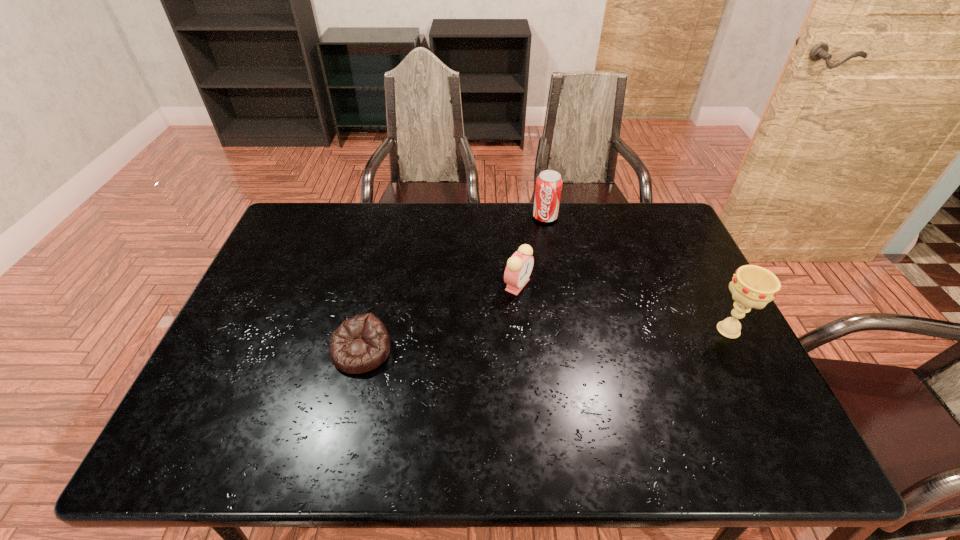
You are a GUI agent. You are given a task and a screenshot of the screen. Output one action in this format:
    pyautogui.click(x=<x>, y=<y>)
    Task: Click on the free spot at the far left corner of the desktop
    Image resolution: width=960 pixels, height=540 pixels.
    Given the screenshot: What is the action you would take?
    pyautogui.click(x=326, y=214)

The width and height of the screenshot is (960, 540). In the image, there is a desktop. What are the coordinates of `vacant space at the far right corner` in the screenshot? It's located at (634, 240).

Identify the location of unoccupied area between the beanbag and the third object from right to left. Image resolution: width=960 pixels, height=540 pixels. (440, 318).

This screenshot has height=540, width=960. I want to click on free space between the third tallest object and the shortest object, so click(440, 318).

Find the location of a particular element. Image resolution: width=960 pixels, height=540 pixels. unoccupied position between the shortest object and the rightmost object is located at coordinates (545, 341).

Find the location of `empty location between the second tallest object and the rightmost object`. empty location between the second tallest object and the rightmost object is located at coordinates (636, 274).

The image size is (960, 540). I want to click on free spot between the shortest object and the chalice, so click(x=545, y=341).

I want to click on free space between the farthest object and the chalice, so click(x=636, y=274).

The height and width of the screenshot is (540, 960). In order to click on empty space that is in between the third tallest object and the shortest object in this screenshot , I will do `click(440, 318)`.

Where is `vacant area that lies between the shortest object and the chalice`? The width and height of the screenshot is (960, 540). vacant area that lies between the shortest object and the chalice is located at coordinates (545, 341).